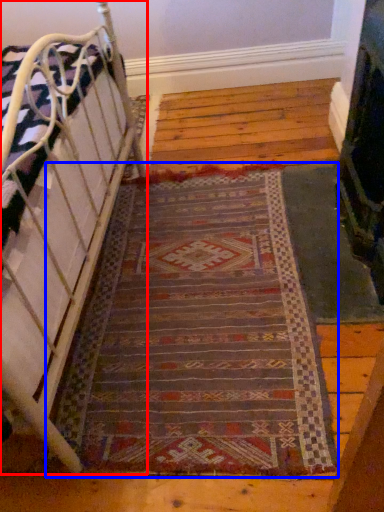
Question: Which object is closer to the camera taking this photo, furniture (highlighted by a red box) or mat (highlighted by a blue box)?

Choices:
 (A) furniture
 (B) mat

Answer: (A)